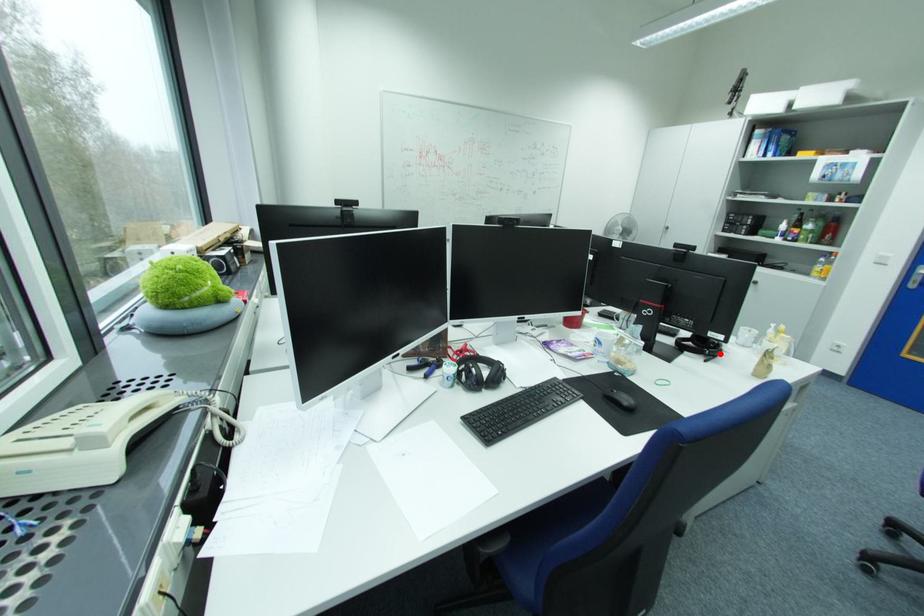
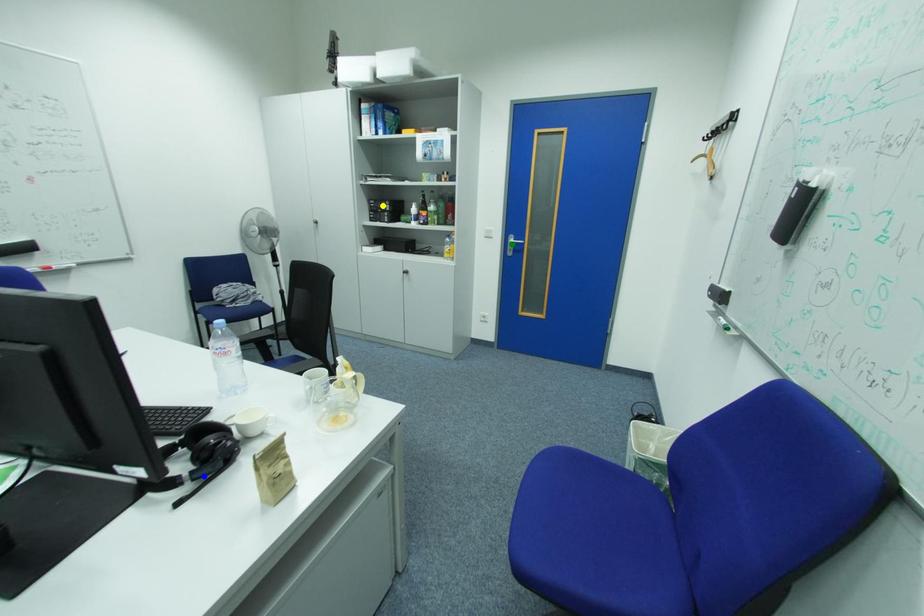
Question: I am providing you with two images of the same scene from different viewpoints. A red point is marked on the first image. You are given multiple points on the second image. Can you choose the point in image 2 that corresponds to the point in image 1?

Choices:
 (A) yellow point
 (B) blue point
 (C) green point

Answer: (B)